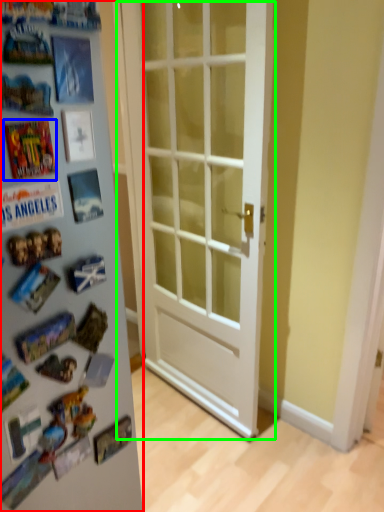
Question: Considering the real-world distances, which object is closest to fridge (highlighted by a red box)? comic book (highlighted by a blue box) or door (highlighted by a green box).

Choices:
 (A) comic book
 (B) door

Answer: (A)